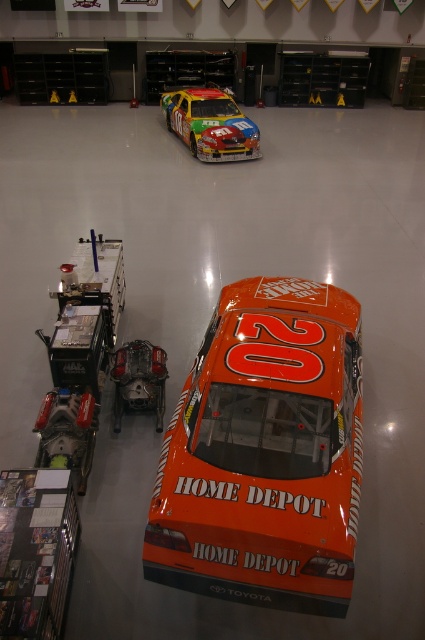
You are a photographer setting up a camera at the entrance of the garage. You need to capture both the orange matte car at center and the shiny metallic race car at center in a single shot. Which car should you position closer to the camera to ensure both are fully visible without cropping?

The orange matte car at center is taller than the shiny metallic race car at center. To ensure both are fully visible without cropping, position the taller orange matte car at center closer to the camera so its height doesn

Based on the scene description, where is the shiny metallic race car at center located in terms of coordinates?

The shiny metallic race car at center is located at coordinates point (210,124).